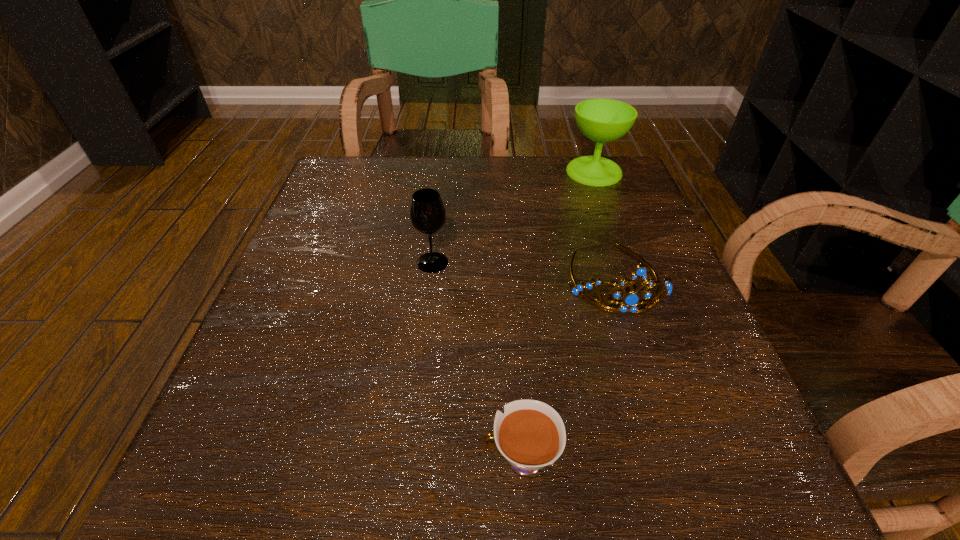
This screenshot has height=540, width=960. What are the coordinates of `the right wineglass` in the screenshot? It's located at (602, 120).

Where is `the farthest object`? The image size is (960, 540). the farthest object is located at coordinates (602, 120).

Where is `the nearer wineglass`? the nearer wineglass is located at coordinates (427, 212).

This screenshot has height=540, width=960. I want to click on the left wineglass, so click(427, 212).

The height and width of the screenshot is (540, 960). I want to click on tiara, so click(629, 303).

Image resolution: width=960 pixels, height=540 pixels. What are the coordinates of `the nearest object` in the screenshot? It's located at (530, 435).

Identify the location of teacup. tap(530, 435).

Identify the location of vacant space located 0.190m on the left of the right wineglass. Image resolution: width=960 pixels, height=540 pixels. (488, 171).

You are a GUI agent. You are given a task and a screenshot of the screen. Output one action in this format:
    pyautogui.click(x=<x>, y=<y>)
    Task: Click on the vacant space located on the right of the nearer wineglass
    
    Given the screenshot: What is the action you would take?
    pyautogui.click(x=587, y=262)

Find the location of a particular element. This screenshot has width=960, height=540. vacant space situated 0.120m on the front-facing side of the second shortest object is located at coordinates (647, 379).